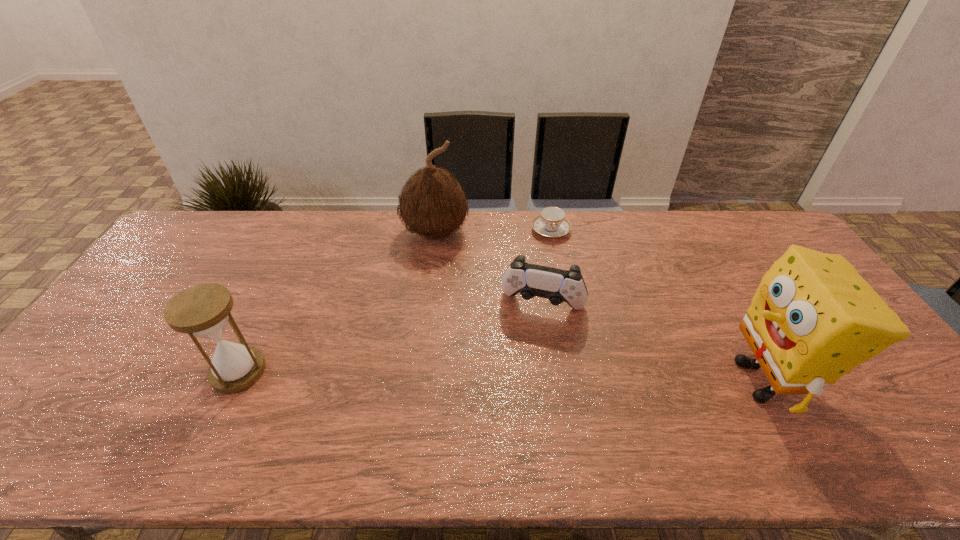
You are a GUI agent. You are given a task and a screenshot of the screen. Output one action in this format:
    pyautogui.click(x=<x>, y=<y>)
    Task: Click on the hourglass
    The width and height of the screenshot is (960, 540).
    Given the screenshot: What is the action you would take?
    pyautogui.click(x=203, y=310)

Locate an element on the screen. This screenshot has width=960, height=540. the third tallest object is located at coordinates (203, 310).

Where is `sponge`? The height and width of the screenshot is (540, 960). sponge is located at coordinates (813, 318).

Where is `control`? Image resolution: width=960 pixels, height=540 pixels. control is located at coordinates (530, 280).

The height and width of the screenshot is (540, 960). What are the coordinates of `the second shortest object` in the screenshot? It's located at (530, 280).

The width and height of the screenshot is (960, 540). In order to click on coconut in this screenshot , I will do `click(433, 204)`.

This screenshot has width=960, height=540. In order to click on teacup in this screenshot , I will do `click(551, 223)`.

I want to click on free location located on the right of the hourglass, so click(284, 372).

At what (x,y) coordinates should I click in order to perform the action: click on vacant area situated on the face of the rightmost object. Please return your answer as a coordinate pair (x, y). This screenshot has width=960, height=540. Looking at the image, I should click on (642, 380).

Locate an element on the screen. blank space located 0.160m on the face of the rightmost object is located at coordinates (659, 380).